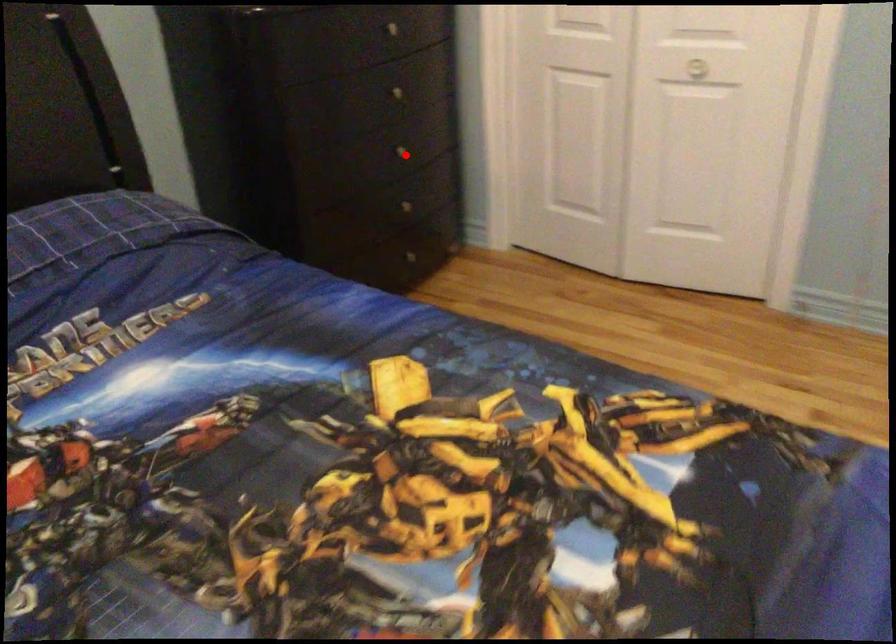
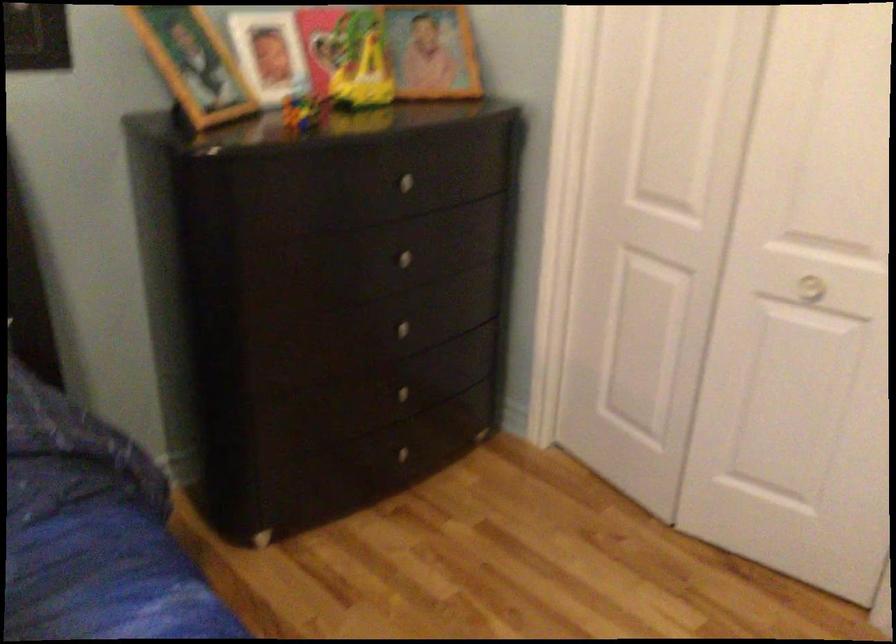
Question: I am providing you with two images of the same scene from different viewpoints. A red point is marked on the first image. Is the red point's position out of view in image 2?

Choices:
 (A) Yes
 (B) No

Answer: (B)